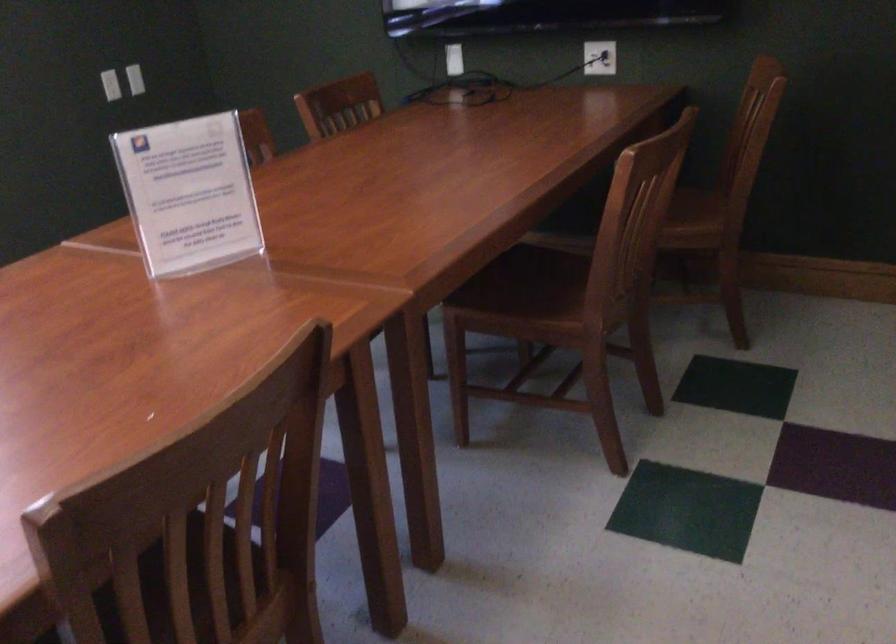
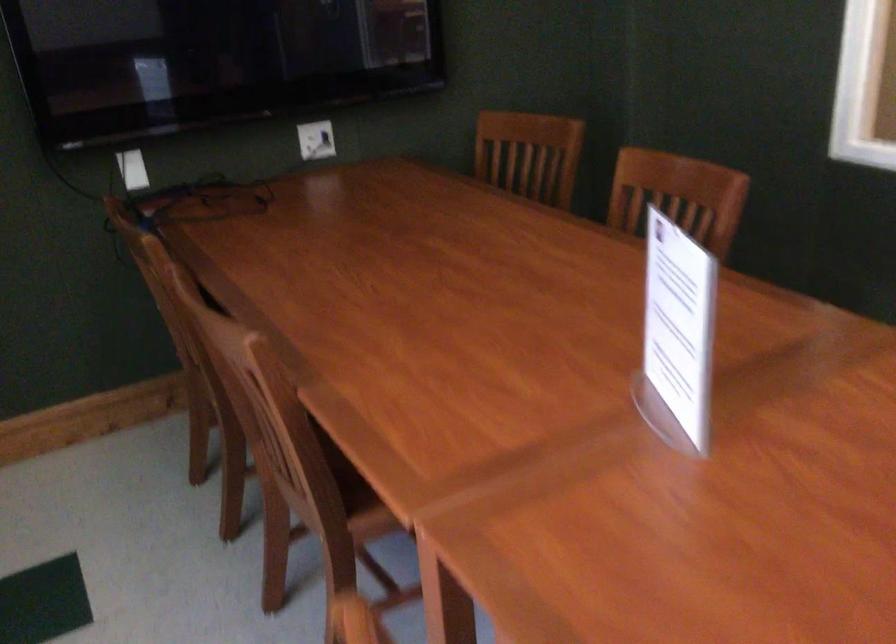
Find the pixel in the second image that matches the point at 650,172 in the first image.

(677, 196)